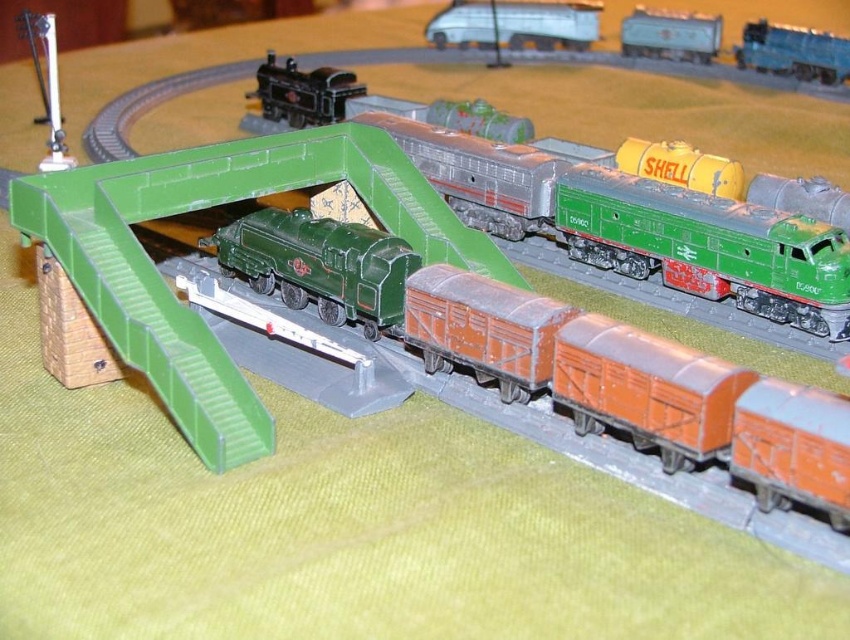
Question: Is green matte locomotive at center positioned at the back of metallic silver truck at upper center?

Choices:
 (A) no
 (B) yes

Answer: (A)

Question: Is green matte train at center to the left of metallic silver truck at upper center from the viewer's perspective?

Choices:
 (A) yes
 (B) no

Answer: (A)

Question: Which point is closer to the camera taking this photo?

Choices:
 (A) (369, 252)
 (B) (463, 3)
 (C) (330, 262)

Answer: (A)

Question: Which of the following is the farthest from the observer?

Choices:
 (A) (647, 42)
 (B) (514, 8)
 (C) (604, 408)

Answer: (B)

Question: Among these points, which one is nearest to the camera?

Choices:
 (A) 315,282
 (B) 653,22

Answer: (A)

Question: Is green matte train at center further to camera compared to green matte locomotive at center?

Choices:
 (A) yes
 (B) no

Answer: (B)